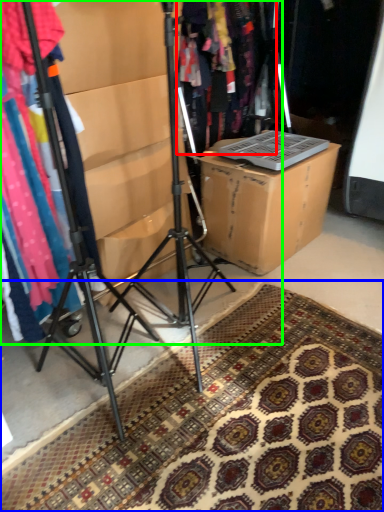
Question: Based on their relative distances, which object is nearer to clothing (highlighted by a red box)? Choose from doormat (highlighted by a blue box) and closet (highlighted by a green box).

Choices:
 (A) doormat
 (B) closet

Answer: (B)